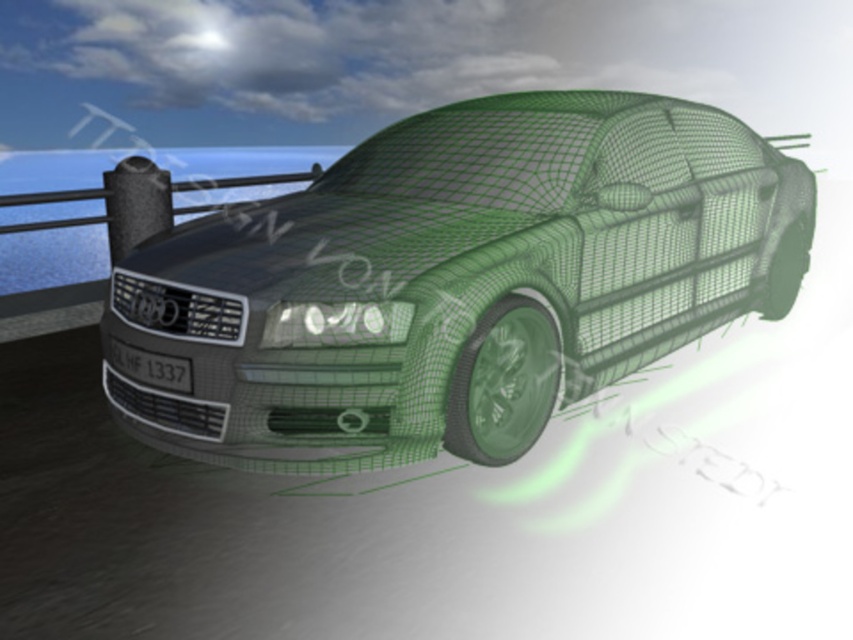
You are a driver approaching the green wireframe car at center and the black plastic license plate at front. Which object will you see first as you move closer to them?

The green wireframe car at center will be seen first because it is positioned in front of the black plastic license plate at front.

Looking at this image, you are a delivery drone operator. Your drone needs to pass under the green wireframe car at center to deliver a package to the black plastic license plate at front. Can the drone, which is 1.2 meters tall, safely fly under the car?

The green wireframe car at center is much taller than the black plastic license plate at front. Since the drone is 1.2 meters tall, it can safely fly under the green wireframe car at center as there is sufficient vertical clearance.